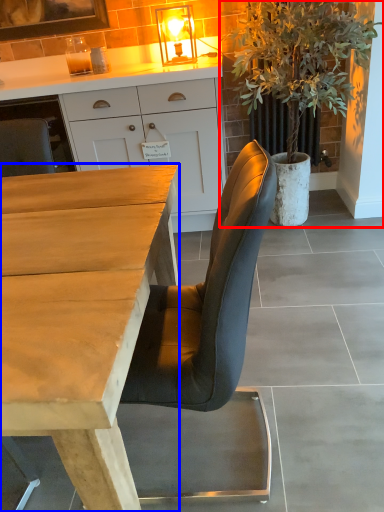
Question: Among these objects, which one is farthest to the camera, houseplant (highlighted by a red box) or desk (highlighted by a blue box)?

Choices:
 (A) houseplant
 (B) desk

Answer: (A)